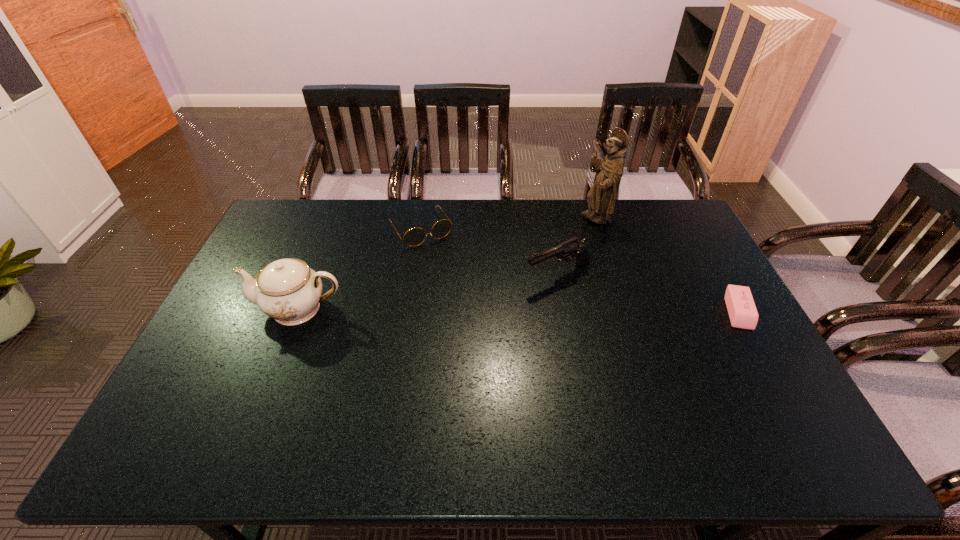
The image size is (960, 540). I want to click on free region located at the spout of the fourth shortest object, so click(x=227, y=309).

I want to click on vacant position located 0.070m at the spout of the fourth shortest object, so click(229, 309).

This screenshot has height=540, width=960. Identify the location of vacant space situated on the back of the eraser. (711, 264).

Find the location of a particular element. This screenshot has height=540, width=960. vacant area located on the lenses of the second shortest object is located at coordinates (448, 269).

You are a GUI agent. You are given a task and a screenshot of the screen. Output one action in this format:
    pyautogui.click(x=<x>, y=<y>)
    Task: Click on the vacant area located 0.220m on the lenses of the second shortest object
    The image size is (960, 540).
    Given the screenshot: What is the action you would take?
    pyautogui.click(x=460, y=287)

Where is `vacant space situated 0.140m on the lenses of the second shortest object`? This screenshot has height=540, width=960. vacant space situated 0.140m on the lenses of the second shortest object is located at coordinates [450, 272].

At what (x,y) coordinates should I click in order to perform the action: click on vacant point located on the front-facing side of the tallest object. Please return your answer as a coordinate pair (x, y). This screenshot has width=960, height=540. Looking at the image, I should click on (558, 259).

Find the location of a particular element. This screenshot has width=960, height=540. vacant area situated 0.090m on the front-facing side of the tallest object is located at coordinates (577, 240).

You are a GUI agent. You are given a task and a screenshot of the screen. Output one action in this format:
    pyautogui.click(x=<x>, y=<y>)
    Task: Click on the free region located on the front-facing side of the tallest object
    The height and width of the screenshot is (540, 960).
    Given the screenshot: What is the action you would take?
    pyautogui.click(x=583, y=235)

At what (x,y) coordinates should I click in order to perform the action: click on free spot located 0.270m at the end of the barrel of the third object from right to left. Please return your answer as a coordinate pair (x, y). Image resolution: width=960 pixels, height=540 pixels. Looking at the image, I should click on (455, 315).